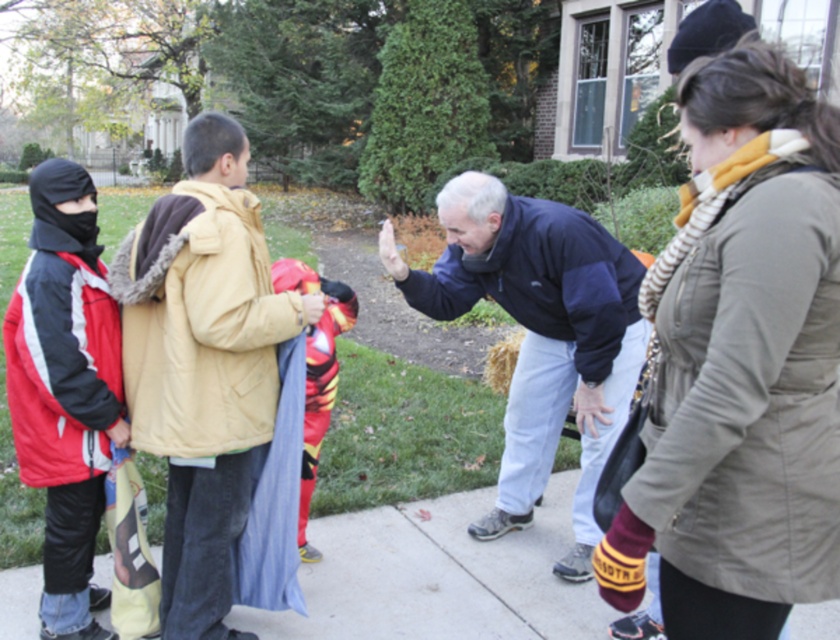
You are organizing a winter clothing sale and need to display the striped scarf at center and the red matte jacket at left. If you have a narrow display stand, which item would you choose to place there to ensure it fits properly?

The striped scarf at center is thinner than the red matte jacket at left, so it would fit better on the narrow display stand.

You are trying to decide which jacket to wear for a walk in the autumn weather. You see the tan fleece jacket at center and the dark blue fleece jacket at center. Which jacket is taller?

The tan fleece jacket at center is taller than the dark blue fleece jacket at center.

You are standing in the outdoor scene and want to walk towards the two points marked in the image. Which point, point (746, 182) or point (40, 604), will you reach first?

Point (746, 182) is closer to the viewer than point (40, 604), so you will reach point (746, 182) first.